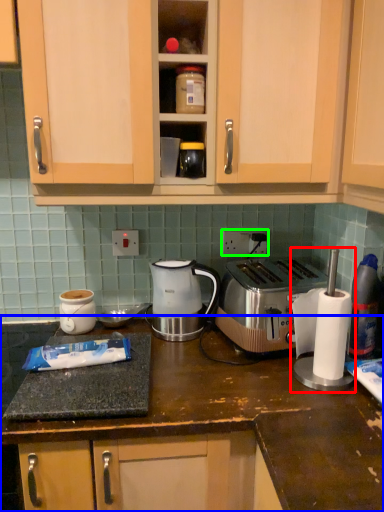
Question: Based on their relative distances, which object is farther from blender (highlighted by a red box)? Choose from countertop (highlighted by a blue box) and electric outlet (highlighted by a green box).

Choices:
 (A) countertop
 (B) electric outlet

Answer: (B)